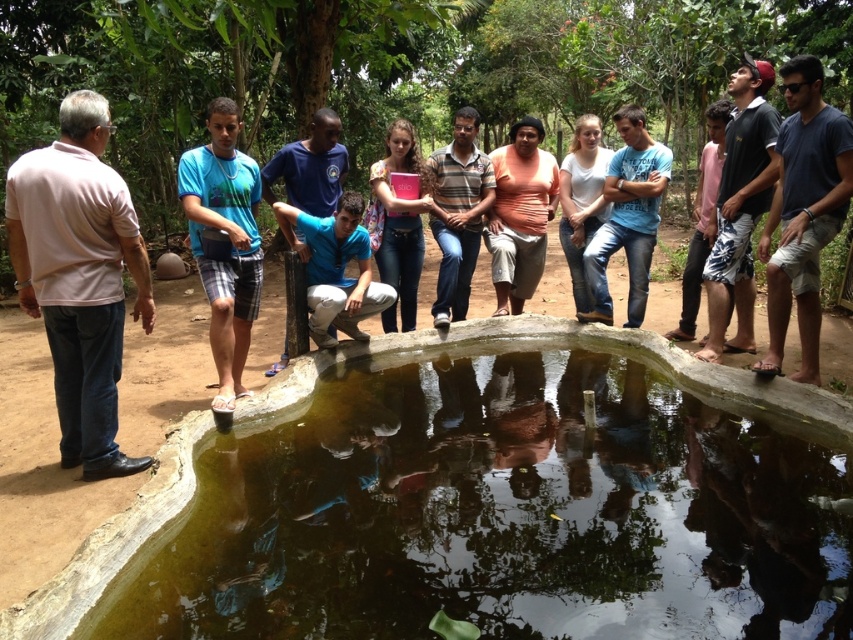
Question: Is matte peach shirt at center to the left of light blue t-shirt at center from the viewer's perspective?

Choices:
 (A) no
 (B) yes

Answer: (B)

Question: Which of the following is the closest to the observer?

Choices:
 (A) (701, 253)
 (B) (643, 218)
 (C) (233, 337)

Answer: (C)

Question: Is matte peach shirt at center wider than light blue t-shirt at center?

Choices:
 (A) yes
 (B) no

Answer: (A)

Question: Which point is closer to the camera?

Choices:
 (A) pink matte book at center
 (B) white cotton shirt at center

Answer: (A)

Question: Is greenish concrete puddle at center bigger than striped cotton shirt at center?

Choices:
 (A) yes
 (B) no

Answer: (A)

Question: Which point appears farthest from the camera in this image?

Choices:
 (A) (55, 275)
 (B) (235, 259)
 (C) (561, 211)

Answer: (C)